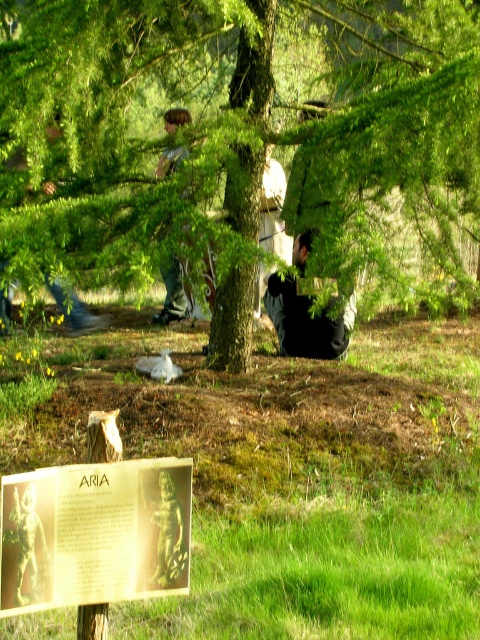
You are standing in the park and see a wooden post with a signboard. The signboard has text that includes the word ARIA. There is also a point at coordinates (305, 321). What is the location of the point relative to the black matte jacket at center?

The point at coordinates (305, 321) is located on the black matte jacket at center.

You are standing in the park and want to walk from the wooden post to the tree trunk. Which direction should you go first? The wooden post is at point (313, 320) and the tree trunk is at point (3, 532). Use the coordinates to determine the direction.

To walk from the wooden post at point (313, 320) to the tree trunk at point (3, 532), you should move towards the lower right direction since the tree trunk is located at a lower y and higher x coordinate compared to the wooden post.